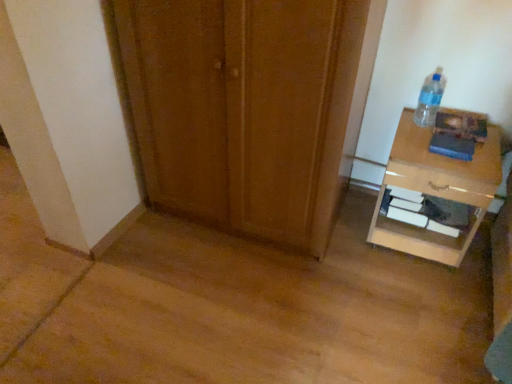
The height and width of the screenshot is (384, 512). I want to click on free spot above light brown glossy nightstand at right (from a real-world perspective), so click(440, 150).